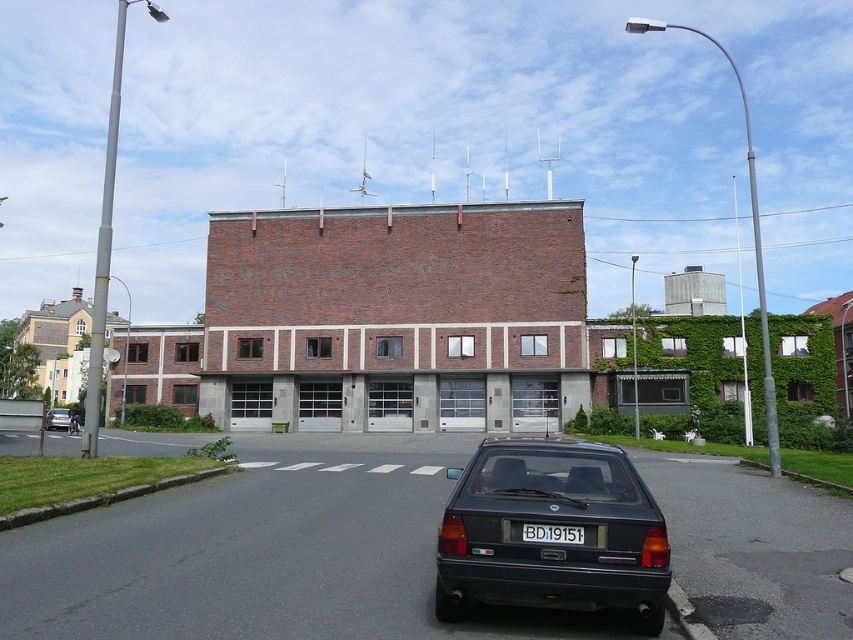
Which is more to the right, matte black hatchback at center or matte black car at lower center?

matte black hatchback at center

Between matte black hatchback at center and matte black car at lower center, which one is positioned lower?

matte black car at lower center is lower down.

What do you see at coordinates (550, 524) in the screenshot? I see `matte black hatchback at center` at bounding box center [550, 524].

Find the location of a particular element. matte black hatchback at center is located at coordinates (550, 524).

Is the position of black plastic license plate at center more distant than that of matte black car at lower center?

No, black plastic license plate at center is closer to the viewer.

Is black plastic license plate at center to the right of matte black car at lower center from the viewer's perspective?

Correct, you'll find black plastic license plate at center to the right of matte black car at lower center.

Between point (560, 525) and point (50, 417), which one is positioned behind?

Point (50, 417)

Where is `black plastic license plate at center`? This screenshot has width=853, height=640. black plastic license plate at center is located at coordinates (552, 532).

Does matte black hatchback at center have a lesser width compared to black plastic license plate at center?

No, matte black hatchback at center is not thinner than black plastic license plate at center.

Is matte black hatchback at center closer to the viewer compared to black plastic license plate at center?

Yes, it is in front of black plastic license plate at center.

Between point (436, 570) and point (573, 540), which one is positioned behind?

The point (436, 570) is more distant.

Locate an element on the screen. This screenshot has width=853, height=640. matte black hatchback at center is located at coordinates (550, 524).